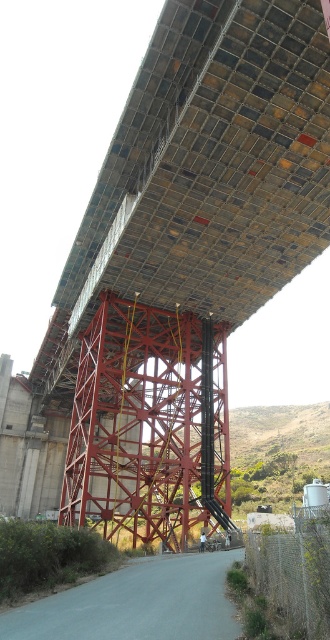
From the picture: You are a construction worker standing at the base of the bridge. You need to locate the metallic grid at upper center for inspection. Using the coordinate system where the bottom left corner is the origin, can you confirm if the point at coordinates (x=204, y=173) falls within the boundaries of the metallic grid at upper center?

The point at coordinates (x=204, y=173) corresponds to the metallic grid at upper center, so yes, the point is within the boundaries of the metallic grid at upper center.

You are an inspector checking the bridge construction. You notice the metallic grid at upper center and the metallic red bridge at center. Which of these two objects is positioned higher in the image?

The metallic grid at upper center is positioned higher than the metallic red bridge at center according to the description.